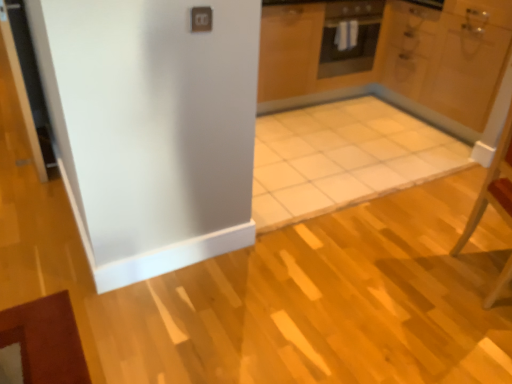
What do you see at coordinates (349, 37) in the screenshot? The height and width of the screenshot is (384, 512). I see `black matte oven at upper center` at bounding box center [349, 37].

Where is `wooden chair at right`? This screenshot has height=384, width=512. wooden chair at right is located at coordinates point(493,187).

In the image, is white glossy door at upper right positioned in front of or behind wooden chair at right?

In the image, white glossy door at upper right appears behind wooden chair at right.

From the image's perspective, which one is positioned higher, white glossy door at upper right or wooden chair at right?

From the image's view, white glossy door at upper right is above.

From a real-world perspective, which object rests below the other?

wooden chair at right, from a real-world perspective.

What's the angular difference between white glossy door at upper right and wooden chair at right's facing directions?

The angular difference between white glossy door at upper right and wooden chair at right is 154 degrees.

Is wooden chair at right thinner than white glossy door at upper right?

Yes, wooden chair at right is thinner than white glossy door at upper right.

Considering the sizes of wooden chair at right and white glossy door at upper right in the image, is wooden chair at right taller or shorter than white glossy door at upper right?

Considering their sizes, wooden chair at right has less height than white glossy door at upper right.

Is wooden chair at right next to white glossy door at upper right and touching it?

No, wooden chair at right is not making contact with white glossy door at upper right.

Based on the photo, from a real-world perspective, is wooden chair at right positioned above or below white glossy door at upper right?

wooden chair at right is situated lower than white glossy door at upper right in the real world.

Considering the sizes of objects black matte oven at upper center and white glossy door at upper right in the image provided, who is taller, black matte oven at upper center or white glossy door at upper right?

white glossy door at upper right is taller.

Consider the image. Could you tell me if black matte oven at upper center is facing white glossy door at upper right?

No, black matte oven at upper center is not oriented towards white glossy door at upper right.

Considering the points (339, 2) and (503, 61), which point is behind, point (339, 2) or point (503, 61)?

Positioned behind is point (339, 2).

From the image's perspective, is black matte oven at upper center located beneath wooden chair at right?

No.

Is black matte oven at upper center shorter than wooden chair at right?

Correct, black matte oven at upper center is not as tall as wooden chair at right.

Are black matte oven at upper center and wooden chair at right far apart?

black matte oven at upper center is positioned a significant distance from wooden chair at right.

Image resolution: width=512 pixels, height=384 pixels. I want to click on chair on the right of black matte oven at upper center, so click(x=493, y=187).

Which object is wider, wooden chair at right or black matte oven at upper center?

With larger width is black matte oven at upper center.

Which of these two, wooden chair at right or black matte oven at upper center, stands shorter?

With less height is black matte oven at upper center.

Looking at this image, which of these two, white glossy door at upper right or black matte oven at upper center, is wider?

With larger width is white glossy door at upper right.

Based on the photo, is black matte oven at upper center located within white glossy door at upper right?

No.

In terms of height, does white glossy door at upper right look taller or shorter compared to black matte oven at upper center?

In the image, white glossy door at upper right appears to be taller than black matte oven at upper center.

From a real-world perspective, is white glossy door at upper right under black matte oven at upper center?

Yes, from a real-world perspective, white glossy door at upper right is beneath black matte oven at upper center.

I want to click on chair below the white glossy door at upper right (from the image's perspective), so click(493, 187).

The image size is (512, 384). In order to click on chair below the white glossy door at upper right (from a real-world perspective) in this screenshot , I will do `click(493, 187)`.

Considering their positions, is wooden chair at right positioned closer to black matte oven at upper center than white glossy door at upper right?

white glossy door at upper right is closer to black matte oven at upper center.

Based on their spatial positions, is white glossy door at upper right or black matte oven at upper center further from wooden chair at right?

The object further to wooden chair at right is black matte oven at upper center.

Considering their positions, is black matte oven at upper center positioned further to white glossy door at upper right than wooden chair at right?

wooden chair at right is further to white glossy door at upper right.

Looking at the image, which one is located further to wooden chair at right, black matte oven at upper center or white glossy door at upper right?

Among the two, black matte oven at upper center is located further to wooden chair at right.

When comparing their distances from black matte oven at upper center, does white glossy door at upper right or wooden chair at right seem further?

wooden chair at right lies further to black matte oven at upper center than the other object.

Estimate the real-world distances between objects in this image. Which object is closer to white glossy door at upper right, wooden chair at right or black matte oven at upper center?

black matte oven at upper center.

The height and width of the screenshot is (384, 512). I want to click on door between wooden chair at right and black matte oven at upper center along the z-axis, so click(466, 69).